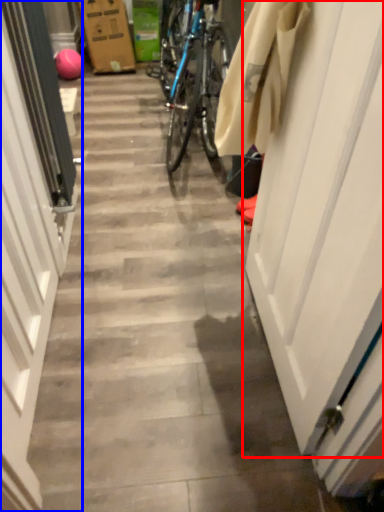
Question: Which point is further to the camera, door (highlighted by a red box) or door (highlighted by a blue box)?

Choices:
 (A) door
 (B) door

Answer: (B)